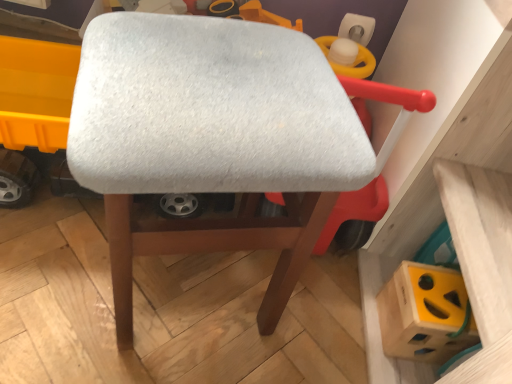
Image resolution: width=512 pixels, height=384 pixels. What do you see at coordinates (218, 138) in the screenshot? I see `textured fabric chair at center` at bounding box center [218, 138].

Where is `textured fabric chair at center`? This screenshot has width=512, height=384. textured fabric chair at center is located at coordinates (218, 138).

The width and height of the screenshot is (512, 384). Identify the location of textured fabric chair at center. (218, 138).